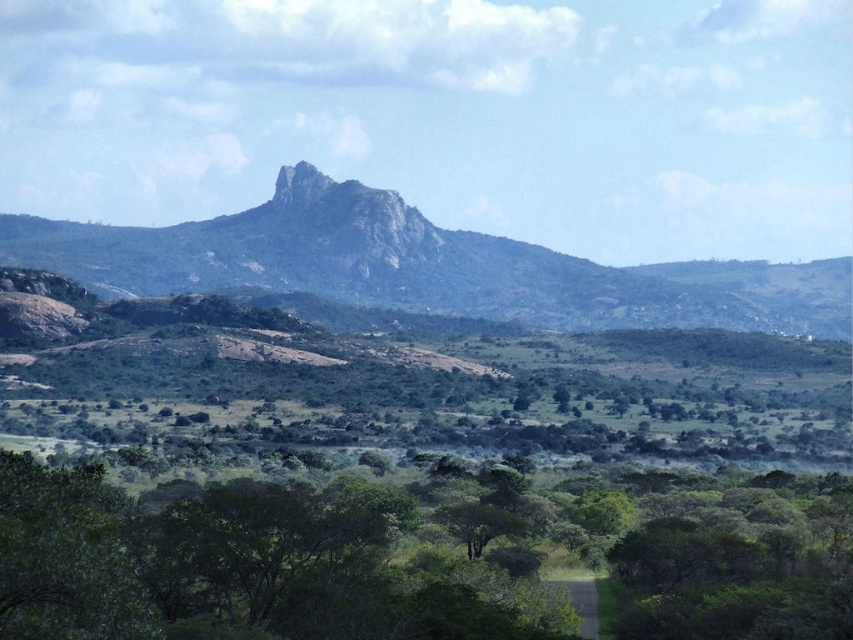
Which is behind, point (28, 470) or point (773, 292)?

Point (773, 292)

Between point (236, 577) and point (706, 312), which one is positioned behind?

The point (706, 312) is more distant.

Identify the location of green leafy tree at lower center. (235, 564).